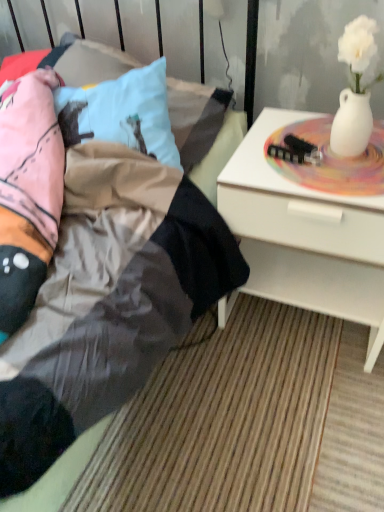
What is the approximate height of white glossy desk at upper right?

21.82 inches.

The height and width of the screenshot is (512, 384). I want to click on white glossy desk at upper right, so click(305, 236).

The width and height of the screenshot is (384, 512). What do you see at coordinates (305, 236) in the screenshot? I see `white glossy desk at upper right` at bounding box center [305, 236].

Identify the location of white glossy desk at upper right. (305, 236).